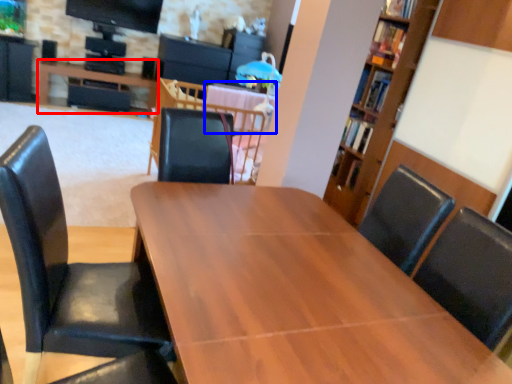
Question: Which object is closer to the camera taking this photo, table (highlighted by a red box) or table (highlighted by a blue box)?

Choices:
 (A) table
 (B) table

Answer: (B)